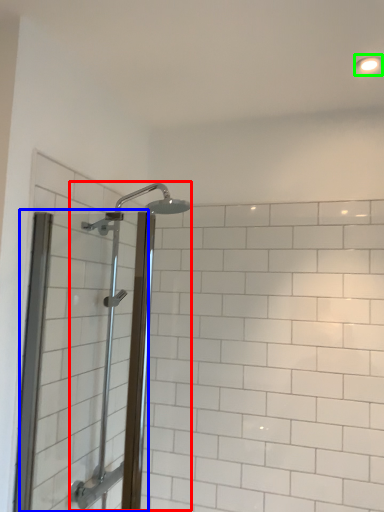
Question: Which is farther away from shower (highlighted by a red box)? screen door (highlighted by a blue box) or light fixture (highlighted by a green box)?

Choices:
 (A) screen door
 (B) light fixture

Answer: (B)